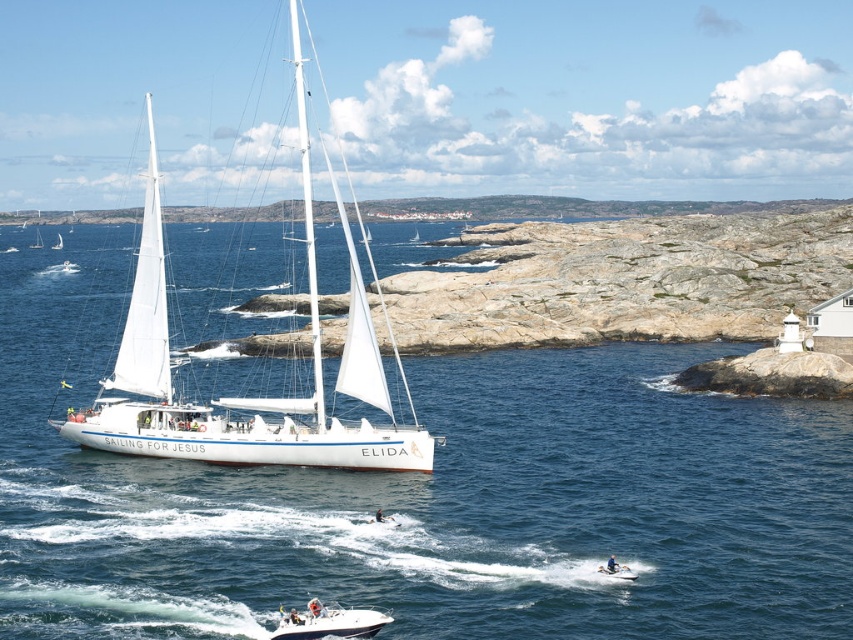
Does white matte sailboat at upper left appear over white sailboat at center?

Correct, white matte sailboat at upper left is located above white sailboat at center.

Does white matte sailboat at upper left have a larger size compared to white sailboat at center?

Correct, white matte sailboat at upper left is larger in size than white sailboat at center.

Image resolution: width=853 pixels, height=640 pixels. What are the coordinates of `white matte sailboat at upper left` in the screenshot? It's located at (38, 234).

Locate an element on the screen. This screenshot has width=853, height=640. white matte sailboat at upper left is located at coordinates (38, 234).

From the picture: Which is more to the left, white matte sailboat at left or white matte boat at lower center?

From the viewer's perspective, white matte sailboat at left appears more on the left side.

Is white matte sailboat at left to the right of white matte boat at lower center from the viewer's perspective?

No, white matte sailboat at left is not to the right of white matte boat at lower center.

Does point (120, 445) come behind point (619, 564)?

That is True.

Find the location of `white matte sailboat at left`. white matte sailboat at left is located at coordinates (245, 397).

Which of these two, white matte boat at lower center or white sailboat at center, stands taller?

With more height is white sailboat at center.

In the scene shown: Does white matte boat at lower center appear on the left side of white sailboat at center?

Incorrect, white matte boat at lower center is not on the left side of white sailboat at center.

I want to click on white matte boat at lower center, so click(618, 572).